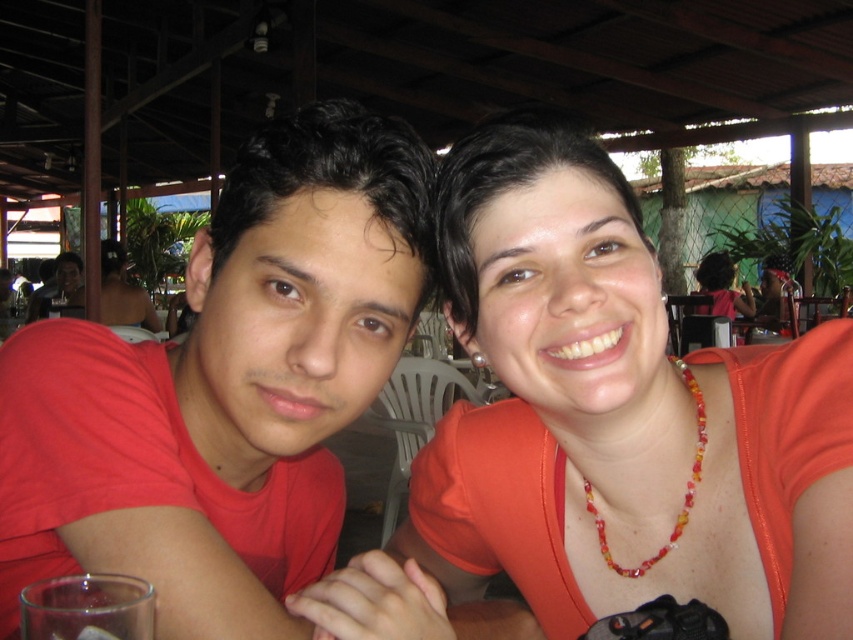
Is point (585, 484) more distant than point (73, 291)?

No.

Does multicolored beaded necklace at upper right come behind matte black laptop at left?

No, it is not.

You are a GUI agent. You are given a task and a screenshot of the screen. Output one action in this format:
    pyautogui.click(x=<x>, y=<y>)
    Task: Click on the multicolored beaded necklace at upper right
    The image size is (853, 640).
    Given the screenshot: What is the action you would take?
    pyautogui.click(x=683, y=496)

Does point (753, 307) come in front of point (59, 262)?

Yes, it is in front of point (59, 262).

Is point (733, 312) farther from viewer compared to point (55, 289)?

No, (733, 312) is in front of (55, 289).

Does point (720, 301) lie behind point (28, 307)?

No, it is not.

Where is `matte orange shirt at upper right`? matte orange shirt at upper right is located at coordinates (722, 288).

Is the position of multicolored beaded necklace at upper right more distant than that of matte orange shirt at upper right?

No, it is not.

Which is above, multicolored beaded necklace at upper right or matte orange shirt at upper right?

matte orange shirt at upper right is higher up.

Between point (650, 561) and point (706, 284), which one is positioned in front?

Positioned in front is point (650, 561).

What are the coordinates of `multicolored beaded necklace at upper right` in the screenshot? It's located at (683, 496).